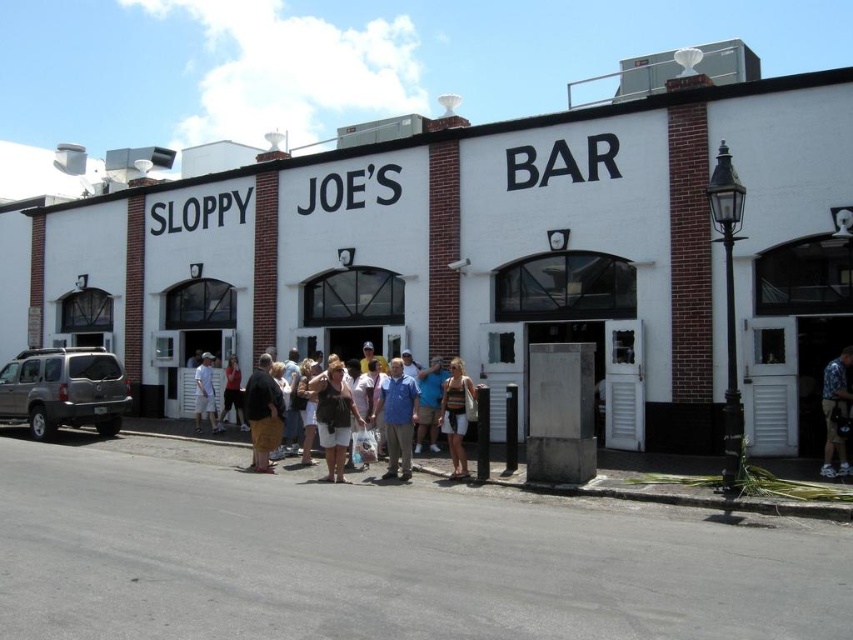
Question: Among these points, which one is nearest to the camera?

Choices:
 (A) (328, 365)
 (B) (508, 131)
 (C) (238, 397)

Answer: (A)

Question: Does striped fabric tank top at center have a smaller size compared to matte red shirt at center?

Choices:
 (A) no
 (B) yes

Answer: (B)

Question: Among these objects, which one is farthest from the camera?

Choices:
 (A) matte red shirt at center
 (B) matte white shorts at center
 (C) brown cotton shorts at center

Answer: (A)

Question: Can you confirm if blue cotton shirt at center is positioned to the right of white cotton shorts at center?

Choices:
 (A) no
 (B) yes

Answer: (B)

Question: Estimate the real-world distances between objects in this image. Which object is closer to the striped fabric tank top at center?

Choices:
 (A) white cotton shorts at center
 (B) brown cotton shorts at center
 (C) matte red shirt at center
 (D) floral-patterned shirt at center

Answer: (B)

Question: Can you confirm if white brick building at center is thinner than matte white shorts at center?

Choices:
 (A) no
 (B) yes

Answer: (A)